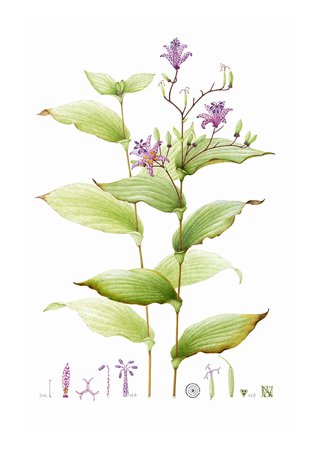
At what (x,y) coordinates should I click in order to perform the action: click on plant without flowers. Please return your answer as a coordinate pair (x, y). The image size is (320, 452). Looking at the image, I should click on (100, 209).